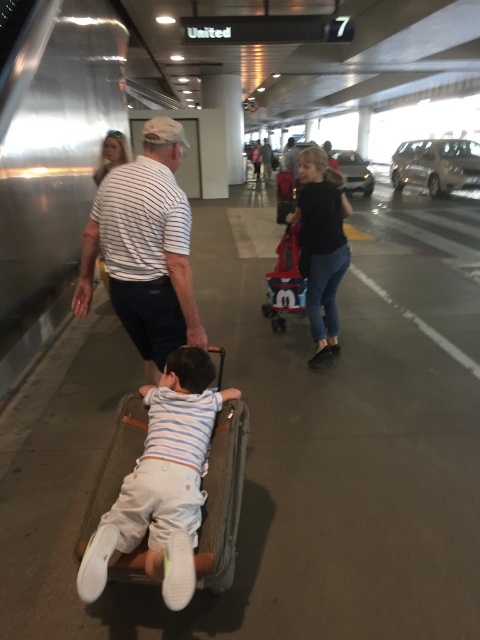
Question: Does light blue striped shirt at center appear on the right side of white striped shirt at center?

Choices:
 (A) no
 (B) yes

Answer: (B)

Question: Is light blue striped shirt at center bigger than white striped shirt at center?

Choices:
 (A) no
 (B) yes

Answer: (A)

Question: Is the position of light blue striped shirt at center less distant than that of white striped shirt at center?

Choices:
 (A) yes
 (B) no

Answer: (A)

Question: Among these points, which one is farthest from the camera?

Choices:
 (A) (180, 474)
 (B) (181, 140)

Answer: (B)